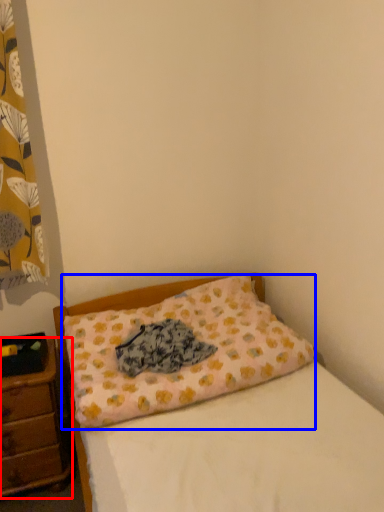
Question: Which point is closer to the camera, nightstand (highlighted by a red box) or pillow (highlighted by a blue box)?

Choices:
 (A) nightstand
 (B) pillow

Answer: (B)